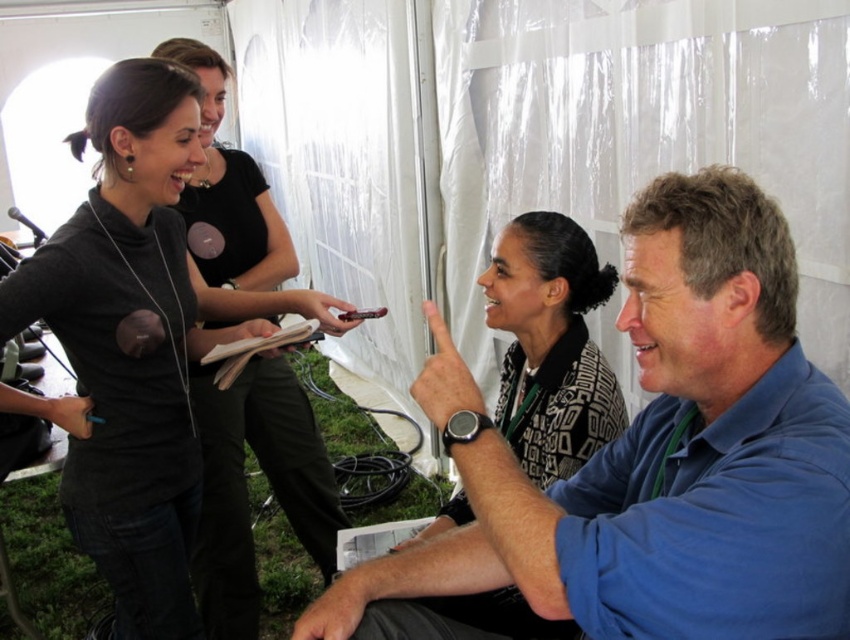
Question: Considering the real-world distances, which object is farthest from the dark gray turtleneck at upper left?

Choices:
 (A) patterned fabric blouse at center
 (B) blue cotton shirt at center

Answer: (B)

Question: Which is nearer to the dark gray turtleneck at upper left?

Choices:
 (A) patterned fabric blouse at center
 (B) blue cotton shirt at center

Answer: (A)

Question: Can you confirm if dark gray turtleneck at upper left is thinner than patterned fabric blouse at center?

Choices:
 (A) yes
 (B) no

Answer: (B)

Question: Which object is closer to the camera taking this photo?

Choices:
 (A) patterned fabric blouse at center
 (B) blue cotton shirt at center

Answer: (B)

Question: Can you confirm if blue cotton shirt at center is positioned below dark gray turtleneck at upper left?

Choices:
 (A) yes
 (B) no

Answer: (A)

Question: Considering the relative positions of dark gray turtleneck at upper left and patterned fabric blouse at center in the image provided, where is dark gray turtleneck at upper left located with respect to patterned fabric blouse at center?

Choices:
 (A) above
 (B) below

Answer: (A)